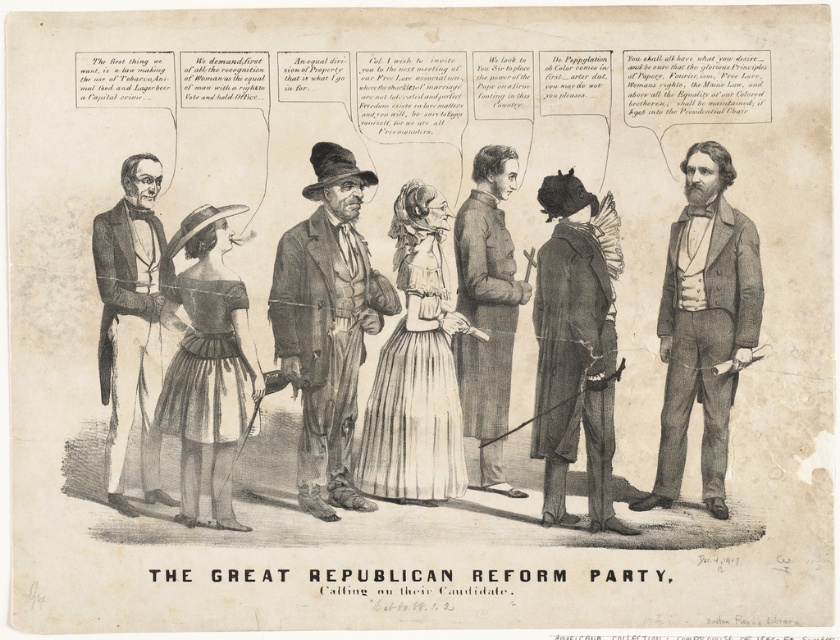
Question: Which point is closer to the camera?

Choices:
 (A) ragged brown coat at center
 (B) matte brown dress at center-left

Answer: (B)

Question: Which object appears farthest from the camera in this image?

Choices:
 (A) white pleated dress at center
 (B) smooth gray suit at right
 (C) dark brown leather coat at center
 (D) dark brown fabric dress at center

Answer: (B)

Question: In this image, where is smooth gray suit at right located relative to dark brown leather coat at center?

Choices:
 (A) left
 (B) right

Answer: (B)

Question: Which of the following is the farthest from the observer?

Choices:
 (A) (198, 278)
 (B) (319, 280)
 (C) (186, 333)

Answer: (B)

Question: Does smooth gray suit at right appear on the right side of dark brown leather coat at center?

Choices:
 (A) yes
 (B) no

Answer: (A)

Question: Does matte brown dress at center-left have a smaller size compared to white pleated dress at center?

Choices:
 (A) no
 (B) yes

Answer: (A)